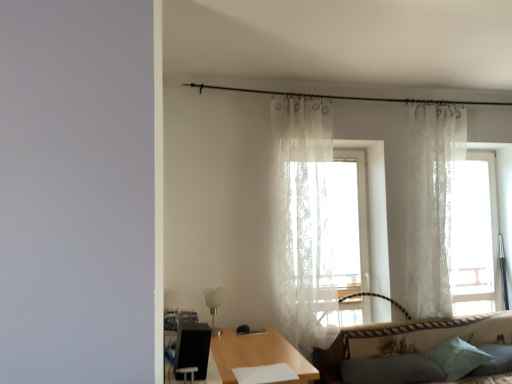
Question: Is the surface of white glass lamp at lower center in direct contact with transparent lace curtain at right?

Choices:
 (A) yes
 (B) no

Answer: (B)

Question: From the image's perspective, is white glass lamp at lower center on top of transparent lace curtain at right?

Choices:
 (A) yes
 (B) no

Answer: (B)

Question: Does white glass lamp at lower center have a lesser height compared to transparent lace curtain at right?

Choices:
 (A) no
 (B) yes

Answer: (B)

Question: Is white glass lamp at lower center bigger than transparent lace curtain at right?

Choices:
 (A) no
 (B) yes

Answer: (A)

Question: Can you confirm if white glass lamp at lower center is taller than transparent lace curtain at right?

Choices:
 (A) yes
 (B) no

Answer: (B)

Question: Considering the positions of sheer white curtain at center, the second curtain in the right-to-left sequence, and dark gray fabric pillow at lower right, acting as the third pillow starting from the right, in the image, is sheer white curtain at center, the second curtain in the right-to-left sequence, wider or thinner than dark gray fabric pillow at lower right, acting as the third pillow starting from the right,?

Choices:
 (A) thin
 (B) wide

Answer: (A)

Question: Is sheer white curtain at center, the second curtain in the right-to-left sequence, situated inside dark gray fabric pillow at lower right, acting as the third pillow starting from the right, or outside?

Choices:
 (A) inside
 (B) outside

Answer: (B)

Question: Is point (318, 134) closer or farther from the camera than point (403, 355)?

Choices:
 (A) closer
 (B) farther

Answer: (B)

Question: Is sheer white curtain at center, the second curtain in the right-to-left sequence, bigger or smaller than dark gray fabric pillow at lower right, the 1th pillow positioned from the left?

Choices:
 (A) small
 (B) big

Answer: (B)

Question: From a real-world perspective, is patterned fabric couch at lower right positioned above or below light blue fabric pillow at lower right, the 2th pillow positioned from the left?

Choices:
 (A) below
 (B) above

Answer: (A)

Question: Is patterned fabric couch at lower right wider or thinner than light blue fabric pillow at lower right, acting as the second pillow starting from the right?

Choices:
 (A) thin
 (B) wide

Answer: (B)

Question: Is patterned fabric couch at lower right in front of or behind light blue fabric pillow at lower right, acting as the second pillow starting from the right, in the image?

Choices:
 (A) front
 (B) behind

Answer: (A)

Question: In terms of height, does patterned fabric couch at lower right look taller or shorter compared to light blue fabric pillow at lower right, acting as the second pillow starting from the right?

Choices:
 (A) short
 (B) tall

Answer: (B)

Question: Is soft blue pillow at lower right, acting as the third pillow starting from the left, wider or thinner than white lace curtain at upper right, the 2th curtain from the left?

Choices:
 (A) thin
 (B) wide

Answer: (B)

Question: Choose the correct answer: Is soft blue pillow at lower right, acting as the third pillow starting from the left, inside white lace curtain at upper right, the 2th curtain from the left, or outside it?

Choices:
 (A) outside
 (B) inside

Answer: (A)